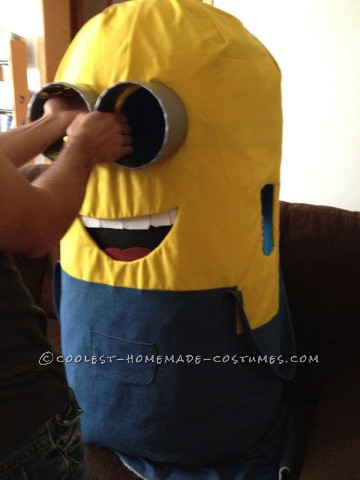
This screenshot has width=360, height=480. I want to click on book shelf, so click(x=15, y=117).